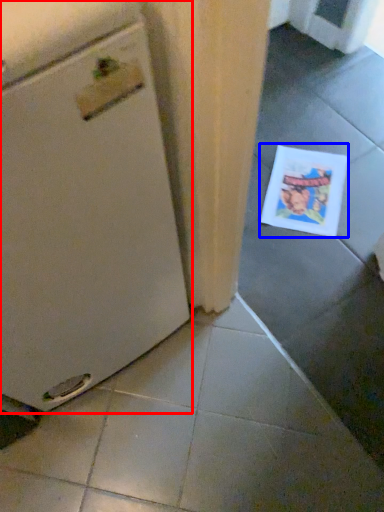
Question: Which object is further to the camera taking this photo, home appliance (highlighted by a red box) or comic book (highlighted by a blue box)?

Choices:
 (A) home appliance
 (B) comic book

Answer: (B)